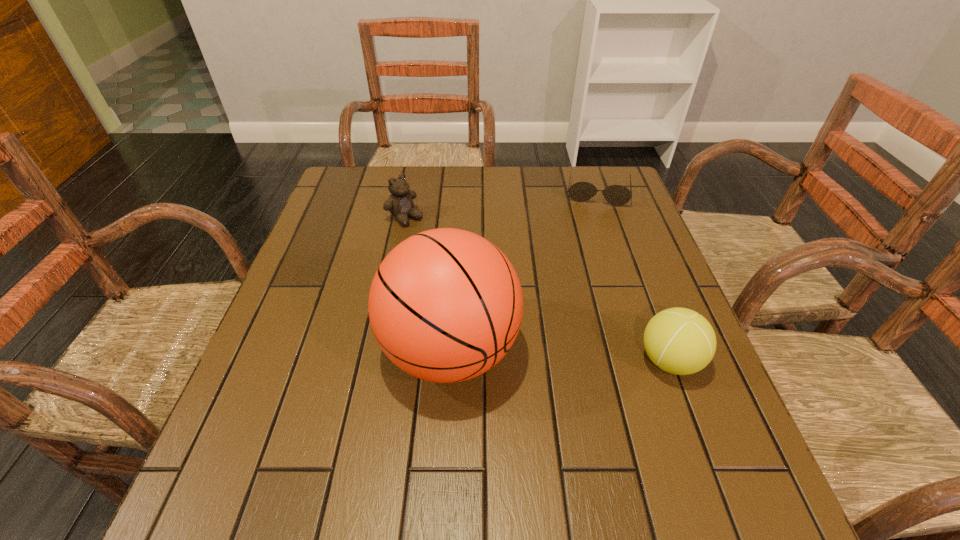
Where is `vacant space on the desktop that is between the tallest object and the tennis ball and is positioned on the face of the teddy bear`? vacant space on the desktop that is between the tallest object and the tennis ball and is positioned on the face of the teddy bear is located at coordinates (589, 357).

In order to click on free space on the desktop that is between the basketball and the tennis ball and is positioned on the front-facing side of the shortest object in this screenshot , I will do [587, 357].